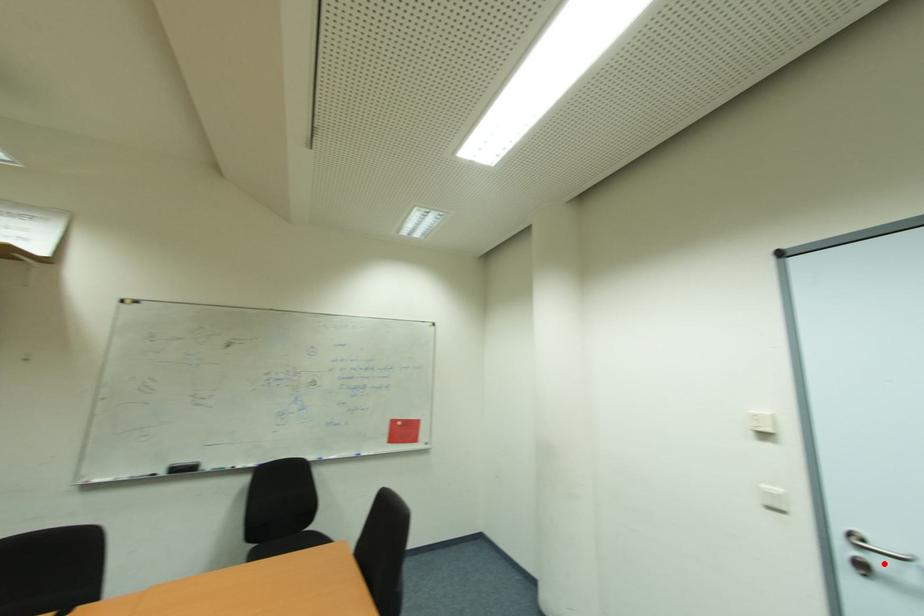
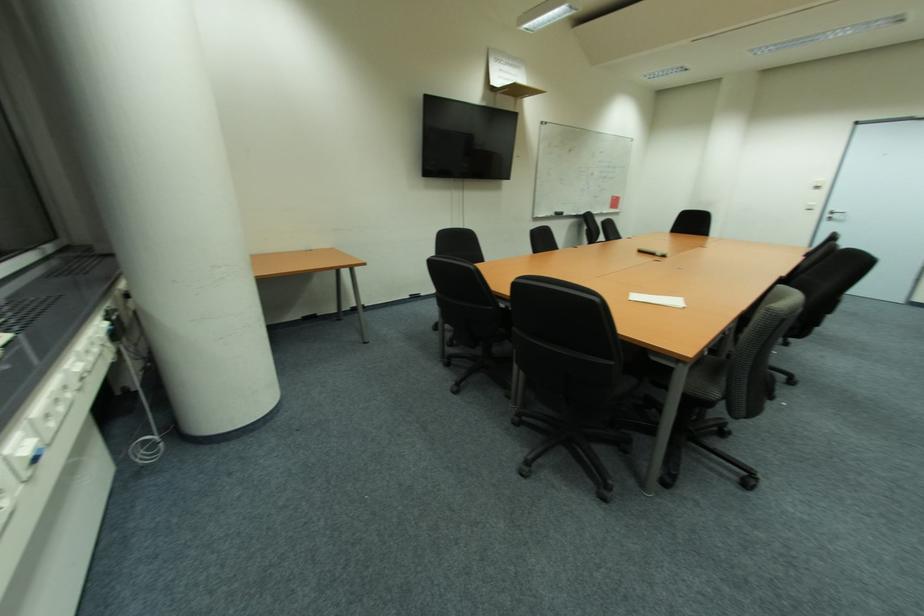
Find the pixel in the second image that matches the highlighted location in the first image.

(842, 217)